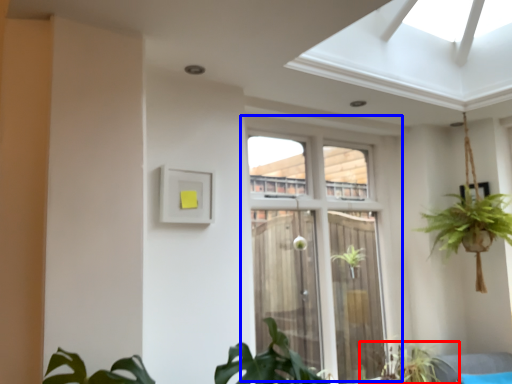
Question: Which object is further to the camera taking this photo, houseplant (highlighted by a red box) or window (highlighted by a blue box)?

Choices:
 (A) houseplant
 (B) window

Answer: (A)